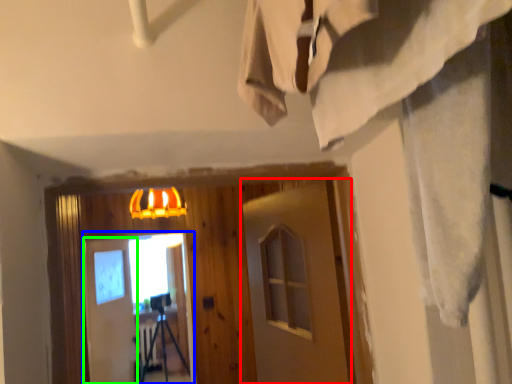
Question: Estimate the real-world distances between objects in this image. Which object is closer to barn door (highlighted by a red box), screen door (highlighted by a blue box) or barn door (highlighted by a green box)?

Choices:
 (A) screen door
 (B) barn door

Answer: (B)